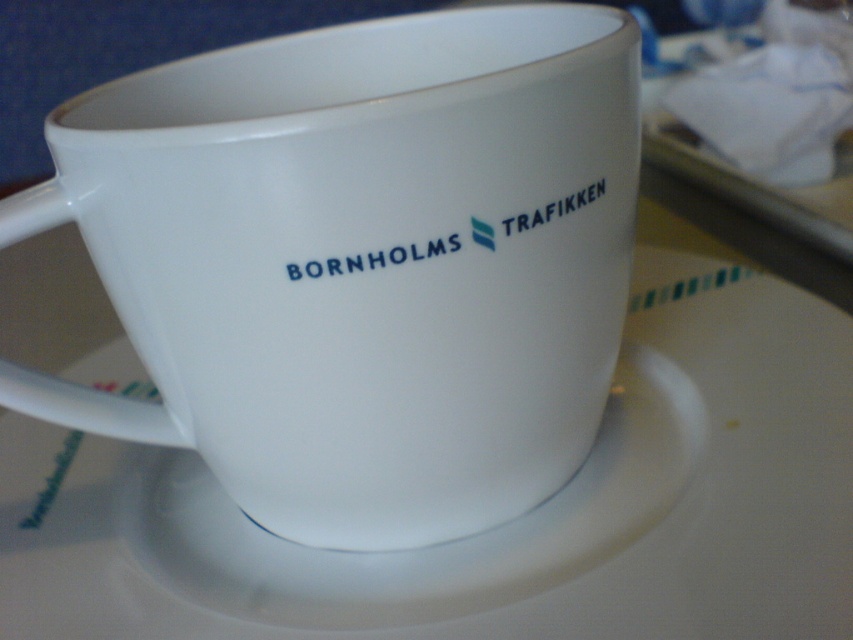
Question: From the image, what is the correct spatial relationship of white ceramic mug at center in relation to blue matte logo at center?

Choices:
 (A) below
 (B) above

Answer: (B)

Question: Which object appears closest to the camera in this image?

Choices:
 (A) blue matte logo at center
 (B) white matte saucer at center
 (C) white matte text at upper right

Answer: (B)

Question: Which object is closer to the camera taking this photo?

Choices:
 (A) white matte saucer at center
 (B) blue matte logo at center
 (C) white ceramic mug at center

Answer: (C)

Question: Does white matte text at center appear on the left side of white matte text at upper right?

Choices:
 (A) yes
 (B) no

Answer: (A)

Question: Is white ceramic mug at center thinner than white matte text at upper right?

Choices:
 (A) no
 (B) yes

Answer: (A)

Question: Which of these objects is positioned closest to the white matte text at center?

Choices:
 (A) white ceramic mug at center
 (B) blue matte logo at center
 (C) white matte saucer at center
 (D) white matte text at upper right

Answer: (B)